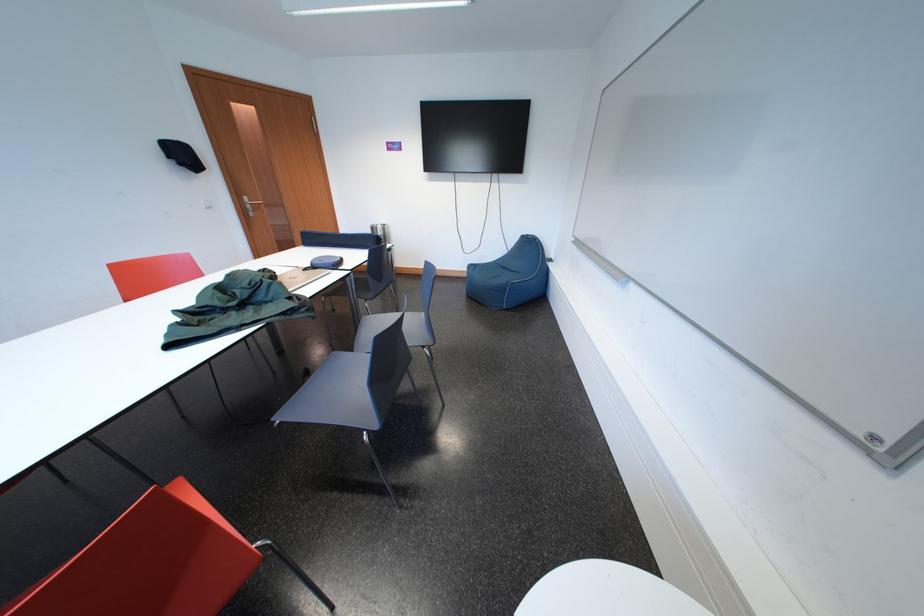
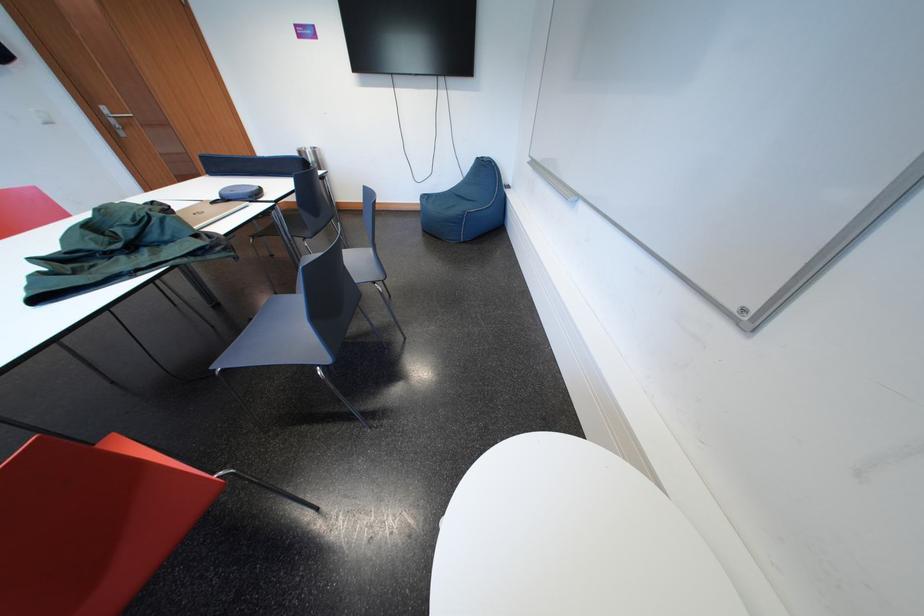
The point at (523, 246) is marked in the first image. Where is the corresponding point in the second image?

(477, 169)